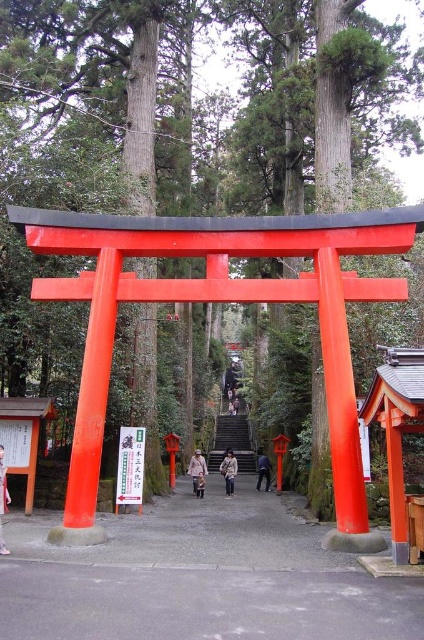
You are standing at the entrance of the shrine and see two coats hanging on a rack in front of you. The beige fabric coat at center and the light brown leather coat at center. Which coat is positioned to the right side?

The beige fabric coat at center is positioned to the right of the light brown leather coat at center.

You are a visitor at the shrine and see a light brown leather jacket at lower left and a beige fabric coat at center. Which item is placed higher up in the image?

The light brown leather jacket at lower left is above the beige fabric coat at center, so it is placed higher up in the image.